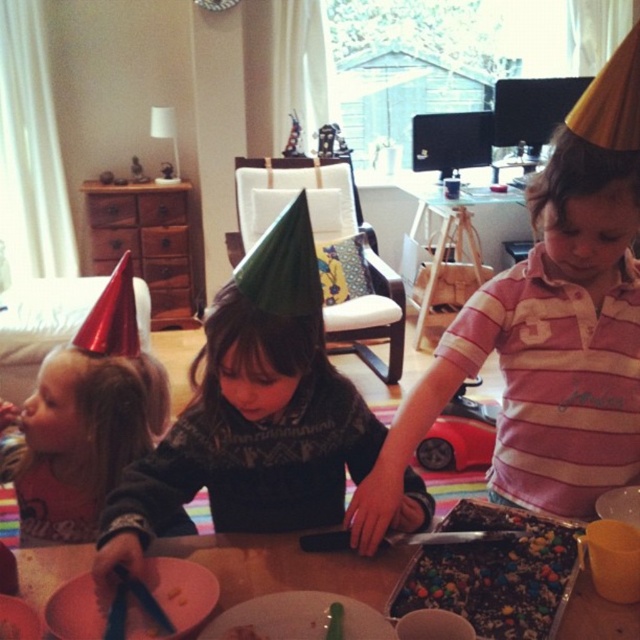
You are a photographer trying to capture the birthday scene. You notice two points of interest marked at coordinates point (67, 570) and point (456, 554). Which point should you focus on first if you want to ensure the closest object is in sharp focus?

Point (67, 570) is further to the camera than point (456, 554), so you should focus on point (67, 570) first to ensure the closest object is in sharp focus.

You are a child at the birthday party and want to place the green felt party hat at center on top of the chocolate cake with colorful candies at center. Is this possible based on their sizes?

The green felt party hat at center is much taller than the chocolate cake with colorful candies at center, so placing it on top would not be possible due to the height difference.

You are a birthday party planner and need to ensure that the green felt party hat at center can fit on the same shelf as the chocolate cake with colorful candies at center without overlapping. Based on their widths, will they both fit side by side if the shelf is 1 meter wide?

The green felt party hat at center might be wider than the chocolate cake with colorful candies at center. If the total width of both items combined is less than or equal to 1 meter, they can fit side by side. However, since the exact width of the cake is unknown, it is uncertain whether they will fit without overlapping.